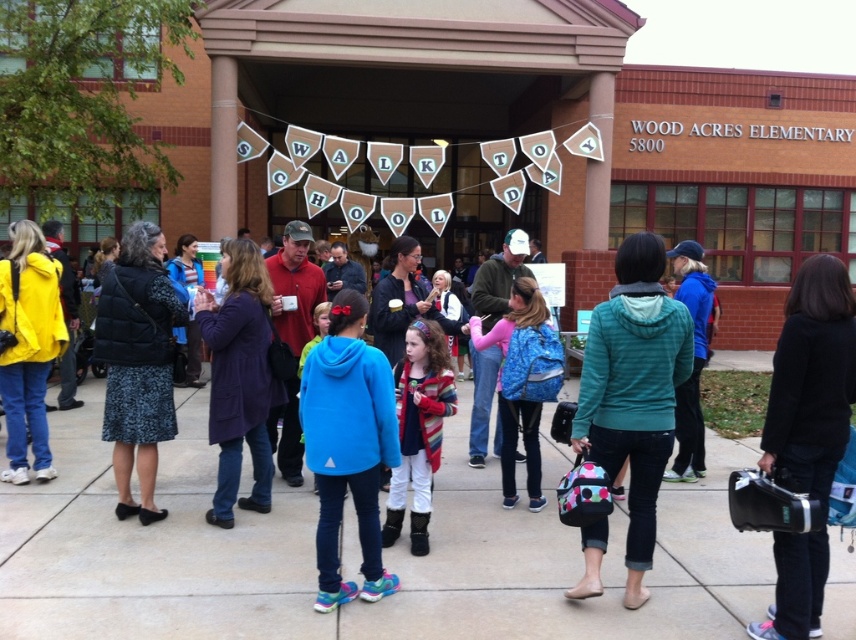
Question: Which point is farther to the camera?

Choices:
 (A) striped sweater at center
 (B) blue fleece jacket at center

Answer: (A)

Question: Does blue fleece jacket at center have a larger size compared to striped sweater at center?

Choices:
 (A) yes
 (B) no

Answer: (B)

Question: Does blue fleece jacket at center appear under striped sweater at center?

Choices:
 (A) yes
 (B) no

Answer: (A)

Question: Does blue fleece jacket at center appear under striped sweater at center?

Choices:
 (A) no
 (B) yes

Answer: (B)

Question: Among these objects, which one is farthest from the camera?

Choices:
 (A) striped sweater at center
 (B) blue fleece jacket at center

Answer: (A)

Question: Which point appears closest to the camera in this image?

Choices:
 (A) (381, 536)
 (B) (272, 625)

Answer: (B)